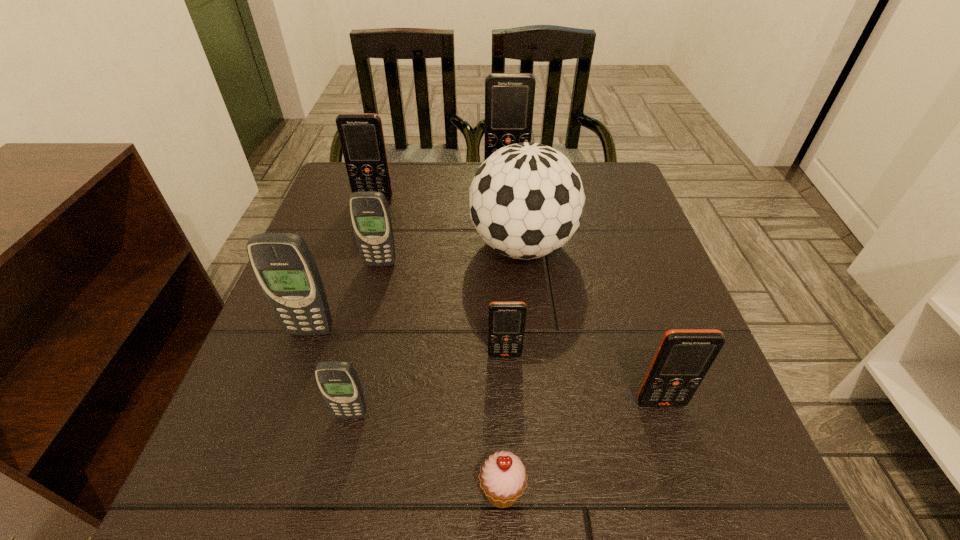
Where is `blank region between the nearest gray cellular telephone and the cupcake`? Image resolution: width=960 pixels, height=540 pixels. blank region between the nearest gray cellular telephone and the cupcake is located at coordinates (426, 453).

Identify the location of vacant point located between the third smallest orange cellular telephone and the leftmost gray cellular telephone. Image resolution: width=960 pixels, height=540 pixels. (343, 265).

Find the location of a particular element. This screenshot has width=960, height=540. unoccupied position between the fifth nearest object and the leftmost orange cellular telephone is located at coordinates (343, 265).

You are a GUI agent. You are given a task and a screenshot of the screen. Output one action in this format:
    pyautogui.click(x=<x>, y=<y>)
    Task: Click on the third closest object to the shortest object
    This screenshot has height=540, width=960.
    Given the screenshot: What is the action you would take?
    pyautogui.click(x=684, y=356)

Point out which object is positioned as the fourth nearest to the second farthest cellular telephone. Please provide its 2D coordinates. Your answer should be formatted as a tuple, i.e. [(x, y)], where the tuple contains the x and y coordinates of a point satisfying the conditions above.

[(283, 264)]

At what (x,y) coordinates should I click in order to perform the action: click on cellular telephone object that ranks as the sixth closest to the rightmost cellular telephone. Please return your answer as a coordinate pair (x, y). This screenshot has height=540, width=960. Looking at the image, I should click on (361, 135).

Choose which cellular telephone is the fourth nearest neighbor to the smallest gray cellular telephone. Please provide its 2D coordinates. Your answer should be formatted as a tuple, i.e. [(x, y)], where the tuple contains the x and y coordinates of a point satisfying the conditions above.

[(684, 356)]

Identify which orange cellular telephone is the fourth nearest to the shortest object. Please provide its 2D coordinates. Your answer should be formatted as a tuple, i.e. [(x, y)], where the tuple contains the x and y coordinates of a point satisfying the conditions above.

[(509, 97)]

Where is `orange cellular telephone that is the second closest to the smallest orange cellular telephone`? orange cellular telephone that is the second closest to the smallest orange cellular telephone is located at coordinates (361, 135).

Identify which gray cellular telephone is the nearest to the third nearest cellular telephone. Please provide its 2D coordinates. Your answer should be formatted as a tuple, i.e. [(x, y)], where the tuple contains the x and y coordinates of a point satisfying the conditions above.

[(338, 382)]